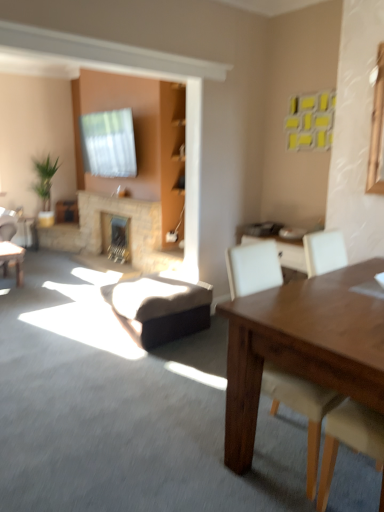
Question: Looking at their shapes, would you say natural stone fireplace at center, which ranks as the second fireplace in back-to-front order, is wider or thinner than stone fireplace at center, the first fireplace positioned from the back?

Choices:
 (A) wide
 (B) thin

Answer: (B)

Question: Is natural stone fireplace at center, which ranks as the second fireplace in back-to-front order, taller or shorter than stone fireplace at center, the 2th fireplace in the front-to-back sequence?

Choices:
 (A) tall
 (B) short

Answer: (A)

Question: Estimate the real-world distances between objects in this image. Which object is farther from the natural stone fireplace at center, positioned as the 1th fireplace in front-to-back order?

Choices:
 (A) brown leather swivel chair at center
 (B) stone fireplace at center, the 2th fireplace in the front-to-back sequence
 (C) green leafy plant at left
 (D) white leather chair at right

Answer: (D)

Question: Which of these objects is positioned closest to the brown leather swivel chair at center?

Choices:
 (A) green leafy plant at left
 (B) stone fireplace at center, the 2th fireplace in the front-to-back sequence
 (C) white leather chair at right
 (D) natural stone fireplace at center, which ranks as the second fireplace in back-to-front order

Answer: (C)